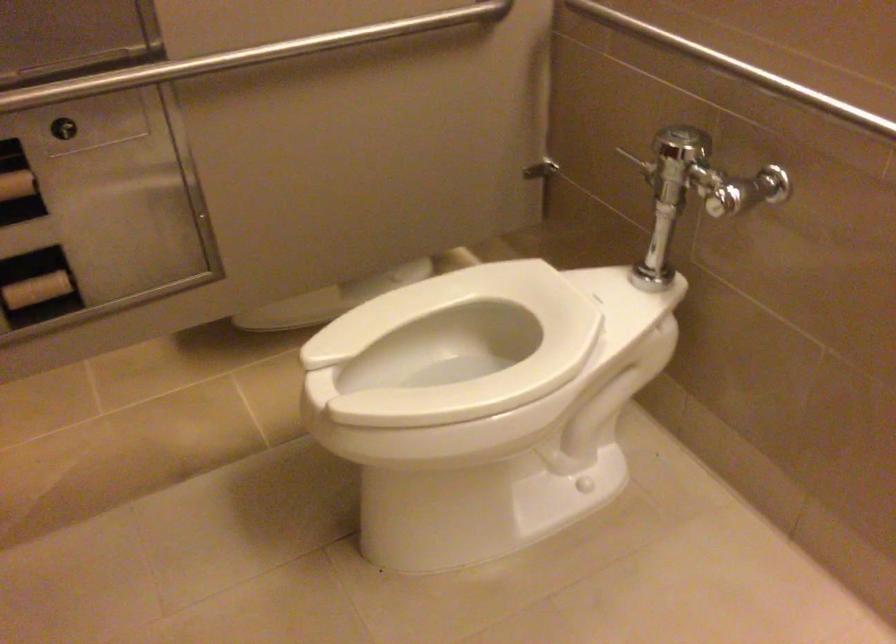
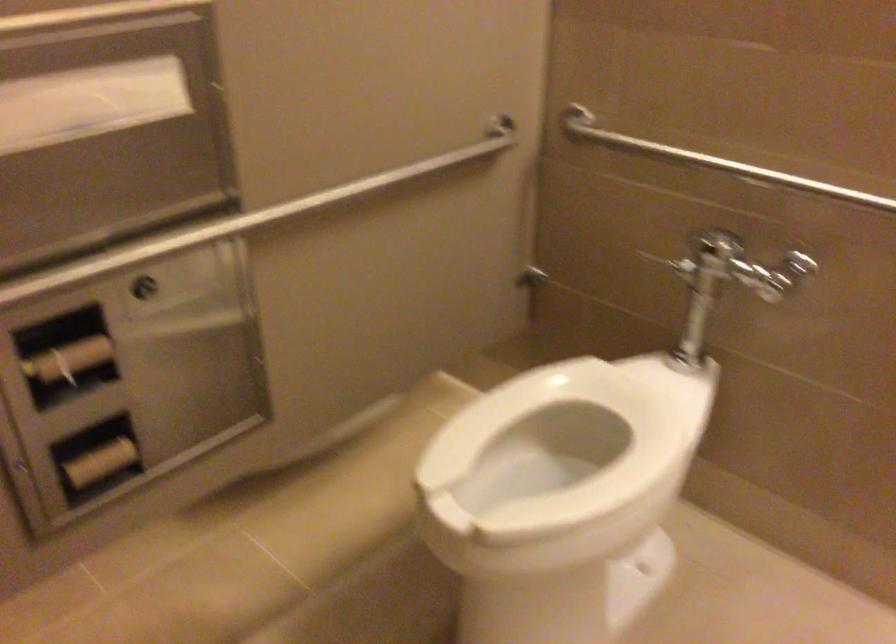
Locate, in the second image, the point that corresponds to pixel 506 334 in the first image.

(563, 431)